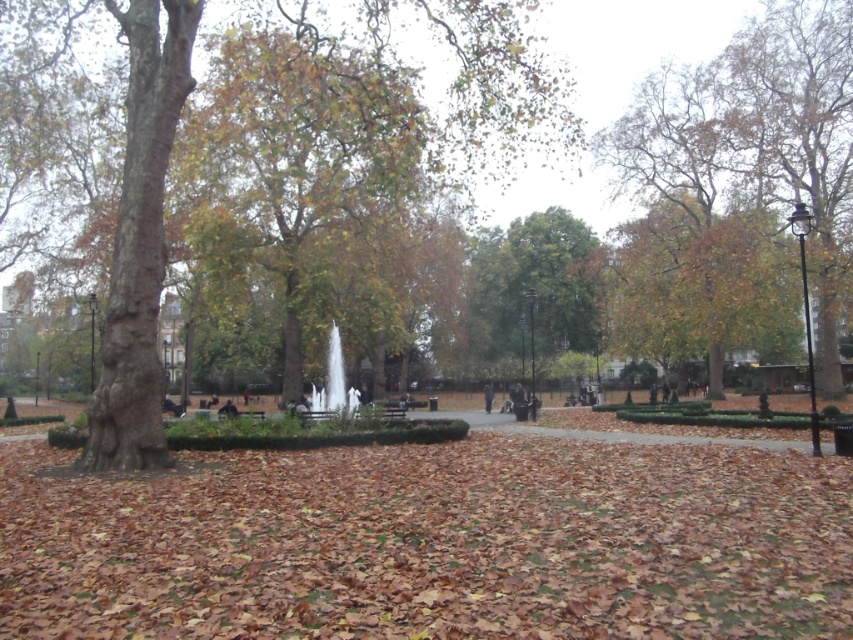
Between brown leaf litter at center and white marble fountain at center, which one is positioned lower?

brown leaf litter at center is lower down.

Which is in front, point (329, 500) or point (350, 401)?

Positioned in front is point (329, 500).

This screenshot has width=853, height=640. In order to click on brown leaf litter at center in this screenshot , I will do `click(430, 541)`.

Does white marble fountain at center come behind dark gray jacket at center?

No.

Is white marble fountain at center to the left of dark gray jacket at center from the viewer's perspective?

Yes, white marble fountain at center is to the left of dark gray jacket at center.

Is point (352, 390) behind point (492, 396)?

No, it is not.

The width and height of the screenshot is (853, 640). I want to click on white marble fountain at center, so click(x=329, y=388).

Which is more to the left, brown leafy tree at upper right or white marble fountain at center?

white marble fountain at center is more to the left.

From the picture: Which is more to the right, brown leafy tree at upper right or white marble fountain at center?

brown leafy tree at upper right

Who is more forward, (804, 19) or (311, 385)?

Point (804, 19)

Identify the location of brown leafy tree at upper right. (757, 134).